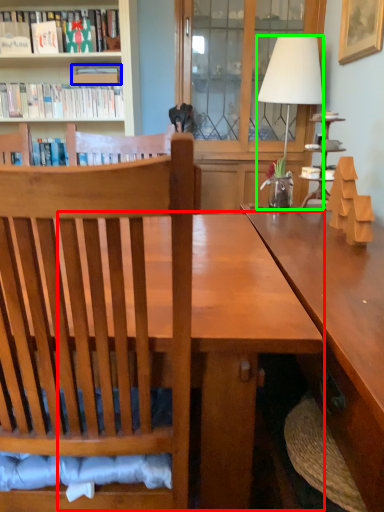
Question: Considering the real-world distances, which object is farthest from table (highlighted by a red box)? book (highlighted by a blue box) or lamp (highlighted by a green box)?

Choices:
 (A) book
 (B) lamp

Answer: (A)